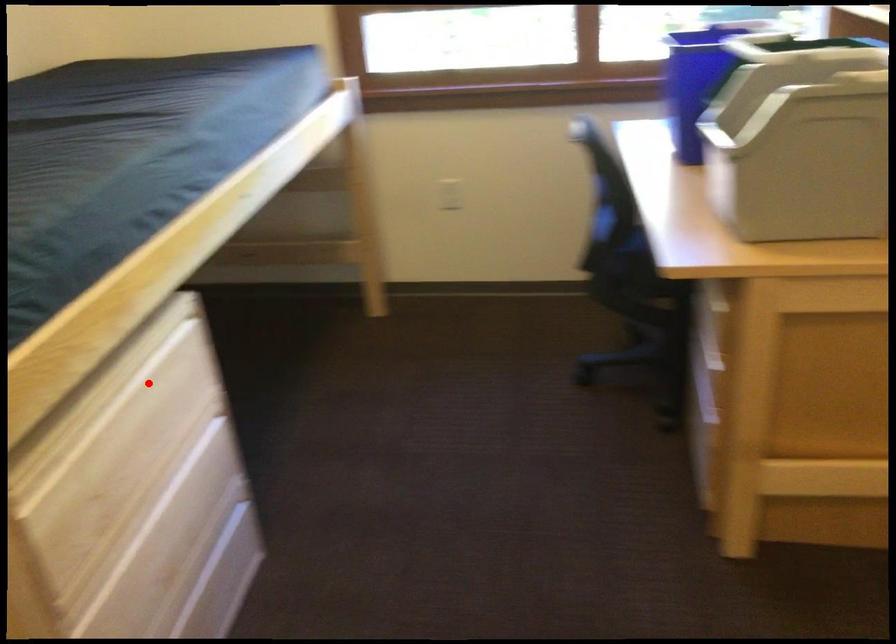
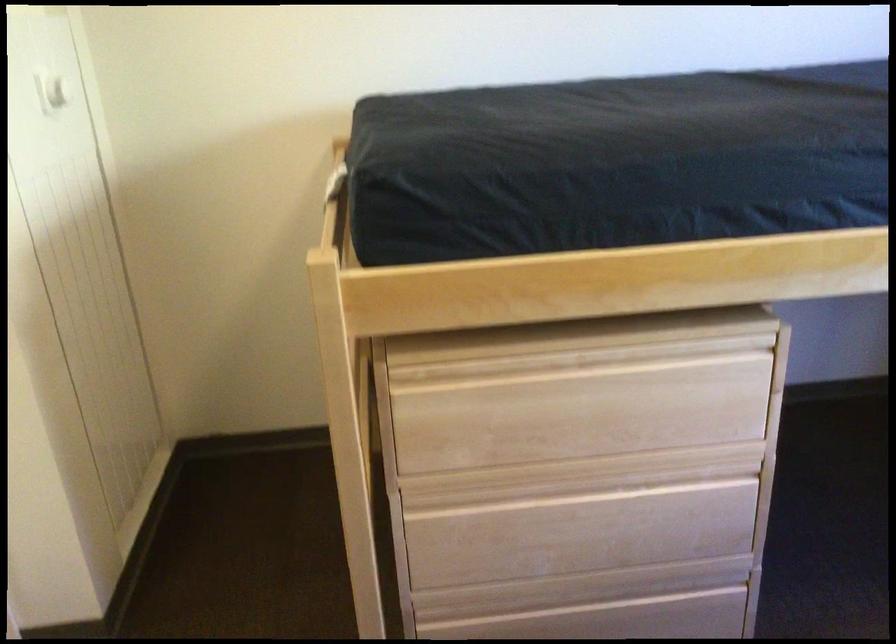
Question: I am providing you with two images of the same scene from different viewpoints. Image1 has a red point marked. In image2, the corresponding 3D location appears at what relative position? Reply with the corresponding letter.

Choices:
 (A) Closer
 (B) Farther

Answer: (A)